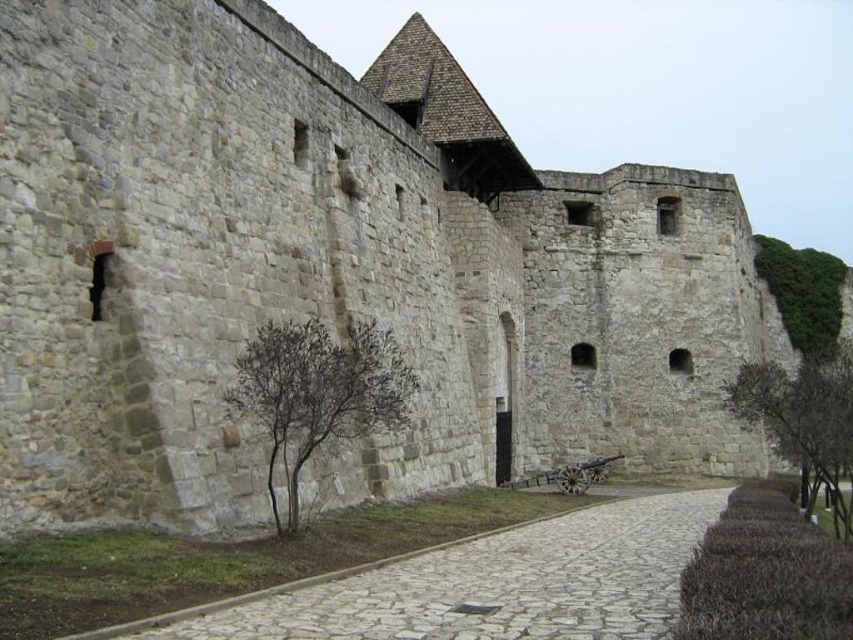
Question: Is pebble stone path at center bigger than green leafy bush at upper right?

Choices:
 (A) yes
 (B) no

Answer: (B)

Question: Does brown leafy tree at right lie in front of green leafy bush at upper right?

Choices:
 (A) no
 (B) yes

Answer: (B)

Question: Where is pebble stone path at center located in relation to brown textured tree at center in the image?

Choices:
 (A) right
 (B) left

Answer: (A)

Question: Among these points, which one is farthest from the camera?

Choices:
 (A) (805, 259)
 (B) (762, 412)
 (C) (332, 340)

Answer: (A)

Question: Which point is closer to the camera?

Choices:
 (A) brown leafy tree at right
 (B) green leafy bush at upper right
 (C) brown textured tree at center

Answer: (C)

Question: Among these objects, which one is farthest from the camera?

Choices:
 (A) brown leafy tree at right
 (B) brown textured tree at center
 (C) green leafy bush at upper right

Answer: (C)